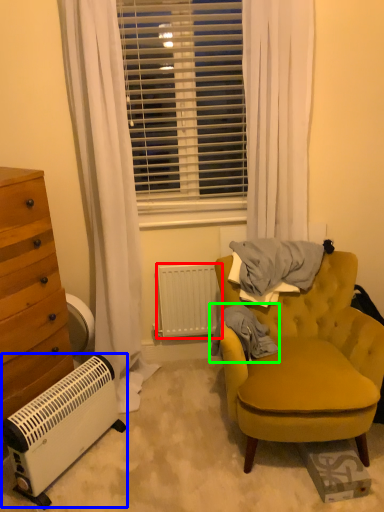
Question: Estimate the real-world distances between objects in this image. Which object is closer to radiator (highlighted by a red box), air conditioning (highlighted by a blue box) or blanket (highlighted by a green box)?

Choices:
 (A) air conditioning
 (B) blanket

Answer: (B)